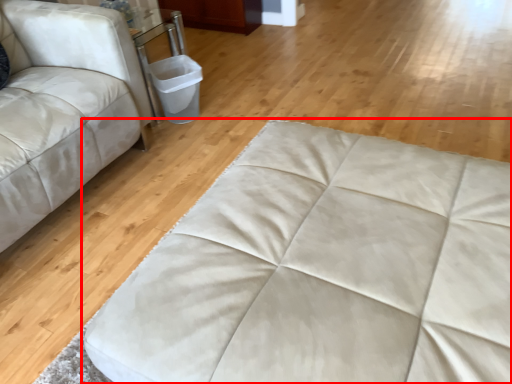
Question: From the image's perspective, where is furniture (annotated by the red box) located relative to studio couch?

Choices:
 (A) above
 (B) below

Answer: (B)